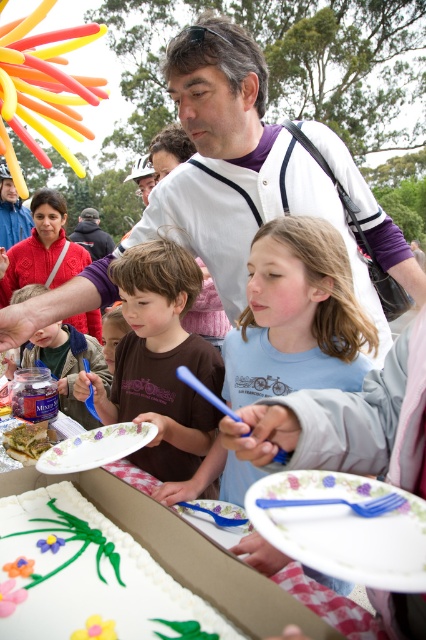
You are at the outdoor gathering and want to grab your plate before the cake gets too low. Where should you look first? The white paper plate at lower center or the green leafy vegetable at center?

The white paper plate at lower center is above the green leafy vegetable at center, so you should look up towards the white paper plate at lower center first.

You are a photographer at the event and want to capture a photo of both the white jersey at center and the light blue cotton shirt at center. Which clothing item should you focus on first to ensure both are in frame without needing to adjust your camera angle?

The white jersey at center is much taller than the light blue cotton shirt at center, so you should focus on the white jersey at center first to ensure both are in frame without needing to adjust your camera angle.